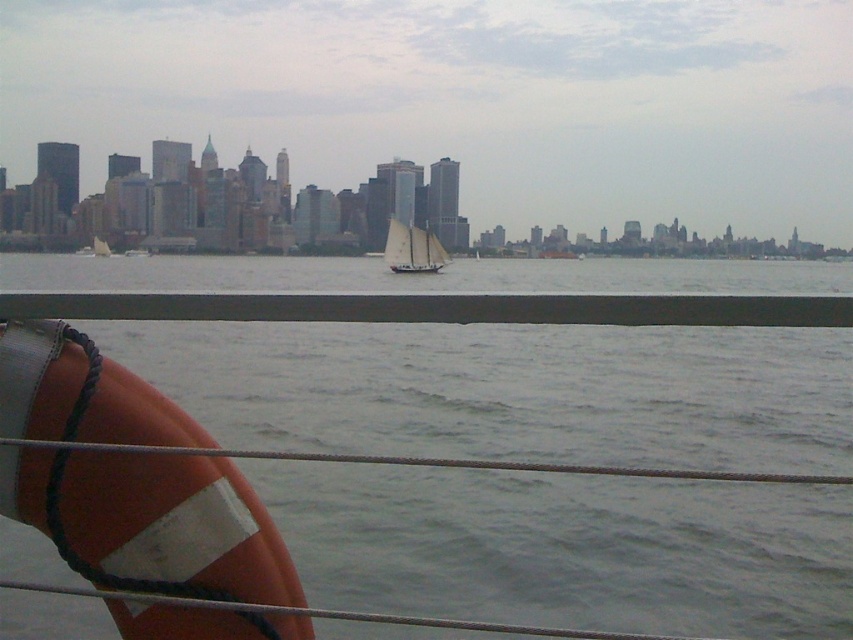
Question: Does gray water at center appear on the left side of white matte sailboat at center?

Choices:
 (A) yes
 (B) no

Answer: (A)

Question: Is gray water at center thinner than white matte sailboat at center?

Choices:
 (A) yes
 (B) no

Answer: (B)

Question: Is orange rubber life jacket at lower left bigger than white matte sailboat at center?

Choices:
 (A) no
 (B) yes

Answer: (A)

Question: Which of the following is the closest to the observer?

Choices:
 (A) (167, 490)
 (B) (297, 417)
 (C) (422, 248)

Answer: (A)

Question: Which of the following is the closest to the observer?

Choices:
 (A) (419, 248)
 (B) (677, 499)

Answer: (B)

Question: Which of the following is the farthest from the observer?

Choices:
 (A) (508, 349)
 (B) (207, 529)

Answer: (A)